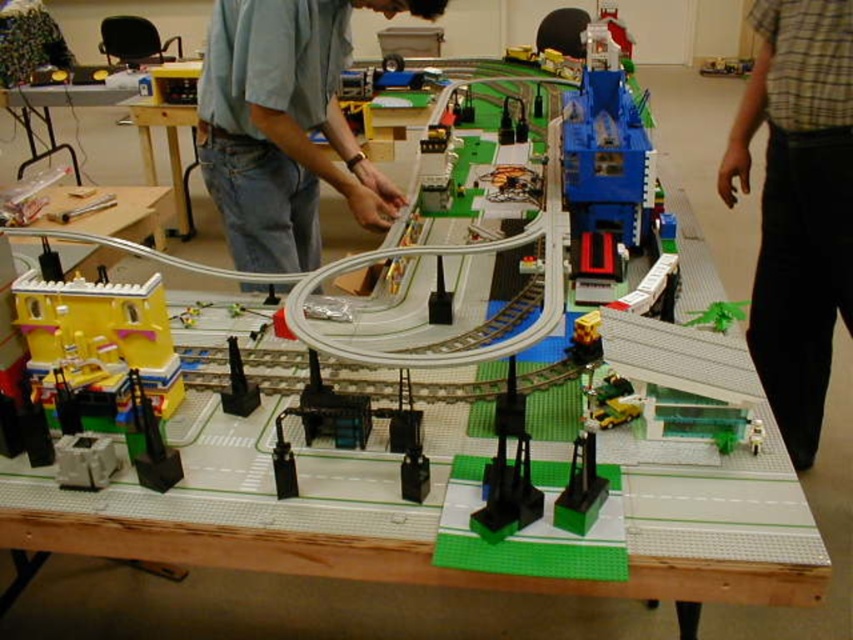
Question: Does yellow plastic building at lower left appear on the left side of blue plastic crane at center?

Choices:
 (A) no
 (B) yes

Answer: (B)

Question: Does plaid shirt at right appear under light blue denim jeans at center?

Choices:
 (A) yes
 (B) no

Answer: (A)

Question: Among these objects, which one is nearest to the camera?

Choices:
 (A) white plastic table at upper left
 (B) yellow plastic building at lower left
 (C) light blue denim jeans at center
 (D) plaid shirt at right

Answer: (B)

Question: Which point appears closest to the camera in this image?

Choices:
 (A) (732, 132)
 (B) (643, 177)
 (C) (164, 204)
 (D) (44, 317)

Answer: (D)

Question: Does blue plastic crane at center have a larger size compared to white plastic table at upper left?

Choices:
 (A) yes
 (B) no

Answer: (B)

Question: Which is farther from the blue plastic crane at center?

Choices:
 (A) light blue denim jeans at center
 (B) white plastic table at upper left
 (C) plaid shirt at right
 (D) yellow plastic building at lower left

Answer: (B)